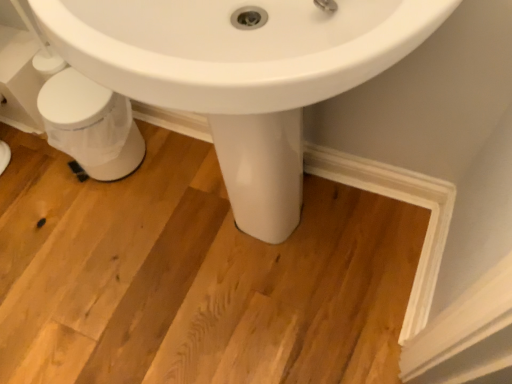
I want to click on white plastic trash can at lower left, so click(x=91, y=125).

Measure the distance between white plastic trash can at lower left and camera.

A distance of 3.51 feet exists between white plastic trash can at lower left and camera.

Describe the element at coordinates (91, 125) in the screenshot. I see `white plastic trash can at lower left` at that location.

This screenshot has height=384, width=512. What do you see at coordinates (241, 74) in the screenshot?
I see `white glossy sink at center` at bounding box center [241, 74].

The width and height of the screenshot is (512, 384). In order to click on white glossy sink at center in this screenshot , I will do [241, 74].

Find the location of `white plastic trash can at lower left`. white plastic trash can at lower left is located at coordinates (91, 125).

Is white plastic trash can at lower left to the left or to the right of white glossy sink at center in the image?

Based on their positions, white plastic trash can at lower left is located to the left of white glossy sink at center.

Which object is further away from the camera, white plastic trash can at lower left or white glossy sink at center?

white plastic trash can at lower left is further away from the camera.

Does point (108, 118) lie behind point (253, 169)?

Yes, point (108, 118) is behind point (253, 169).

From the image's perspective, is white plastic trash can at lower left below white glossy sink at center?

No.

From a real-world perspective, is white plastic trash can at lower left located higher than white glossy sink at center?

No.

Which of these two, white plastic trash can at lower left or white glossy sink at center, is wider?

With larger width is white glossy sink at center.

Considering the relative sizes of white plastic trash can at lower left and white glossy sink at center in the image provided, is white plastic trash can at lower left taller than white glossy sink at center?

No, white plastic trash can at lower left is not taller than white glossy sink at center.

Considering the sizes of objects white plastic trash can at lower left and white glossy sink at center in the image provided, who is smaller, white plastic trash can at lower left or white glossy sink at center?

white plastic trash can at lower left.

Could white glossy sink at center be considered to be inside white plastic trash can at lower left?

Actually, white glossy sink at center is outside white plastic trash can at lower left.

Are white plastic trash can at lower left and white glossy sink at center located far from each other?

No, white plastic trash can at lower left is not far from white glossy sink at center.

Is white plastic trash can at lower left oriented away from white glossy sink at center?

That's not correct — white plastic trash can at lower left is not looking away from white glossy sink at center.

In the image, there is a white glossy sink at center. In order to click on porcelain below it (from a real-world perspective) in this screenshot , I will do `click(91, 125)`.

Which object is positioned more to the left, white glossy sink at center or white plastic trash can at lower left?

Positioned to the left is white plastic trash can at lower left.

Considering their positions, is white glossy sink at center located in front of or behind white plastic trash can at lower left?

Visually, white glossy sink at center is located in front of white plastic trash can at lower left.

Which point is more forward, (228, 31) or (45, 122)?

The point (228, 31) is more forward.

From the image's perspective, which object appears higher, white glossy sink at center or white plastic trash can at lower left?

From the image's view, white plastic trash can at lower left is above.

From a real-world perspective, is white glossy sink at center physically located above or below white plastic trash can at lower left?

white glossy sink at center is situated higher than white plastic trash can at lower left in the real world.

Considering the relative sizes of white glossy sink at center and white plastic trash can at lower left in the image provided, is white glossy sink at center wider than white plastic trash can at lower left?

Indeed, white glossy sink at center has a greater width compared to white plastic trash can at lower left.

Is white glossy sink at center taller or shorter than white plastic trash can at lower left?

Clearly, white glossy sink at center is taller compared to white plastic trash can at lower left.

Is white glossy sink at center bigger than white plastic trash can at lower left?

Indeed, white glossy sink at center has a larger size compared to white plastic trash can at lower left.

Consider the image. Is white glossy sink at center not within white plastic trash can at lower left?

Yes, white glossy sink at center is located beyond the bounds of white plastic trash can at lower left.

Is there a large distance between white glossy sink at center and white plastic trash can at lower left?

No, there isn't a large distance between white glossy sink at center and white plastic trash can at lower left.

Consider the image. Could you tell me if white glossy sink at center is facing white plastic trash can at lower left?

No, white glossy sink at center does not turn towards white plastic trash can at lower left.

Can you tell me how much white glossy sink at center and white plastic trash can at lower left differ in facing direction?

1.41 degrees.

Locate an element on the screen. The image size is (512, 384). sink that is in front of the white plastic trash can at lower left is located at coordinates (241, 74).

Find the location of a particular element. The width and height of the screenshot is (512, 384). porcelain lying on the left of white glossy sink at center is located at coordinates (91, 125).

The width and height of the screenshot is (512, 384). Find the location of `porcelain that appears behind the white glossy sink at center`. porcelain that appears behind the white glossy sink at center is located at coordinates (91, 125).